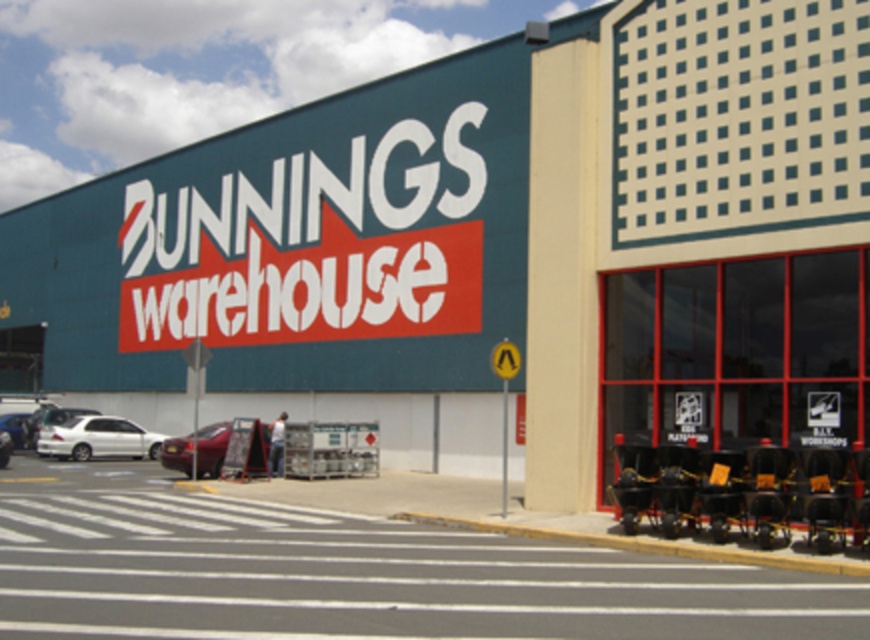
Is metallic red car at center-left above white matte sedan at center?

Yes, metallic red car at center-left is above white matte sedan at center.

Is metallic red car at center-left closer to camera compared to white matte sedan at center?

Yes, metallic red car at center-left is closer to the viewer.

Does point (189, 465) come behind point (9, 433)?

No, it is not.

The image size is (870, 640). I want to click on metallic red car at center-left, so click(211, 448).

Consider the image. Which of these two, white matte sedan at lower left or white matte sedan at center, stands taller?

With more height is white matte sedan at lower left.

Find the location of `white matte sedan at lower left`. white matte sedan at lower left is located at coordinates (97, 438).

Is white glossy sedan at center taller than white matte sedan at center?

Indeed, white glossy sedan at center has a greater height compared to white matte sedan at center.

Is white glossy sedan at center to the left of white matte sedan at center from the viewer's perspective?

Correct, you'll find white glossy sedan at center to the left of white matte sedan at center.

Identify the location of white glossy sedan at center. This screenshot has height=640, width=870. pos(18,428).